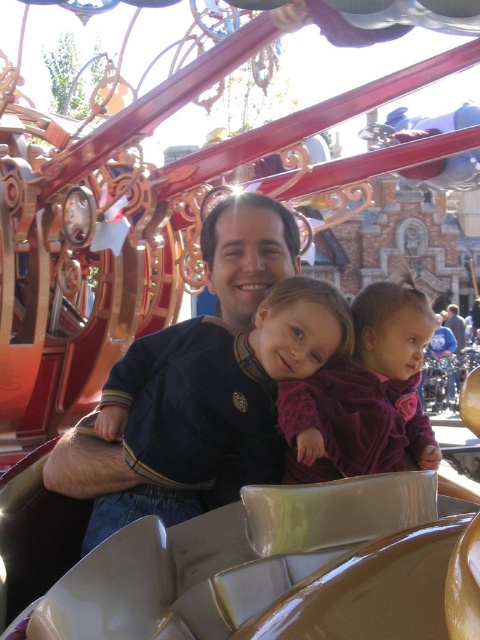
Does matte blue shirt at center lie behind purple velvet dress at center?

Yes, it is behind purple velvet dress at center.

Does matte blue shirt at center have a lesser width compared to purple velvet dress at center?

No, matte blue shirt at center is not thinner than purple velvet dress at center.

Between point (276, 259) and point (336, 413), which one is positioned behind?

The point (276, 259) is more distant.

What are the coordinates of `matte blue shirt at center` in the screenshot? It's located at (206, 380).